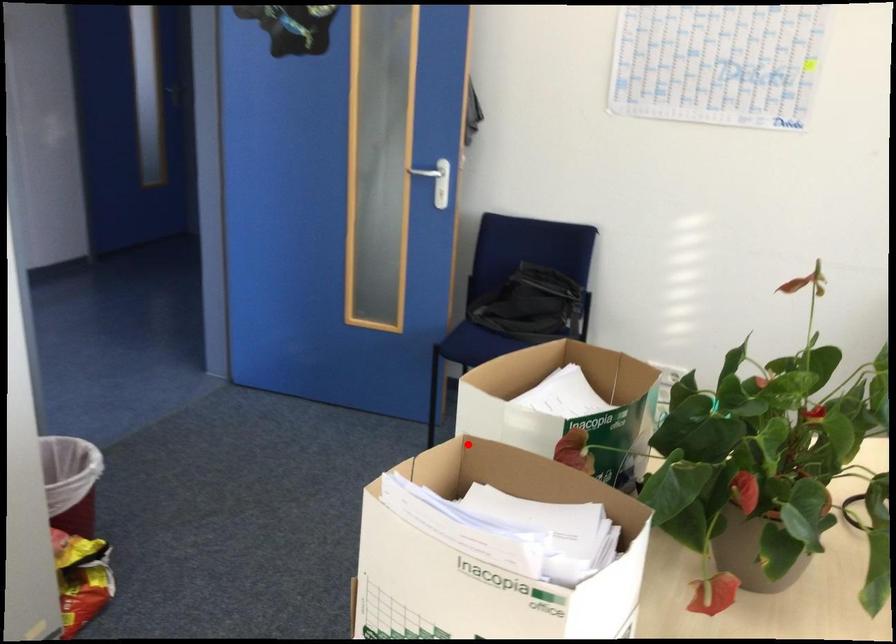
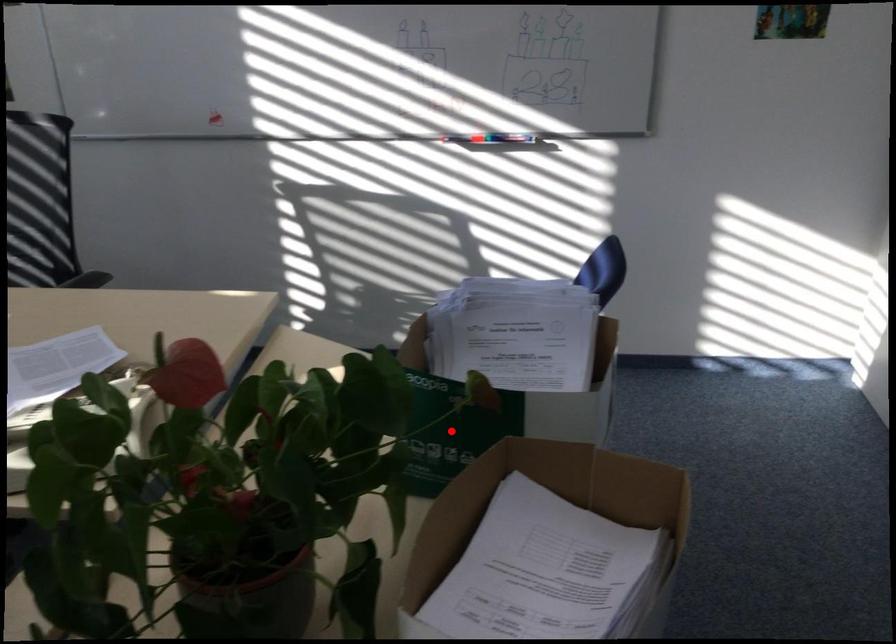
I am providing you with two images of the same scene from different viewpoints. A red point is marked on the first image and another point is marked on the second image. Do the highlighted points in image1 and image2 indicate the same real-world spot?

No